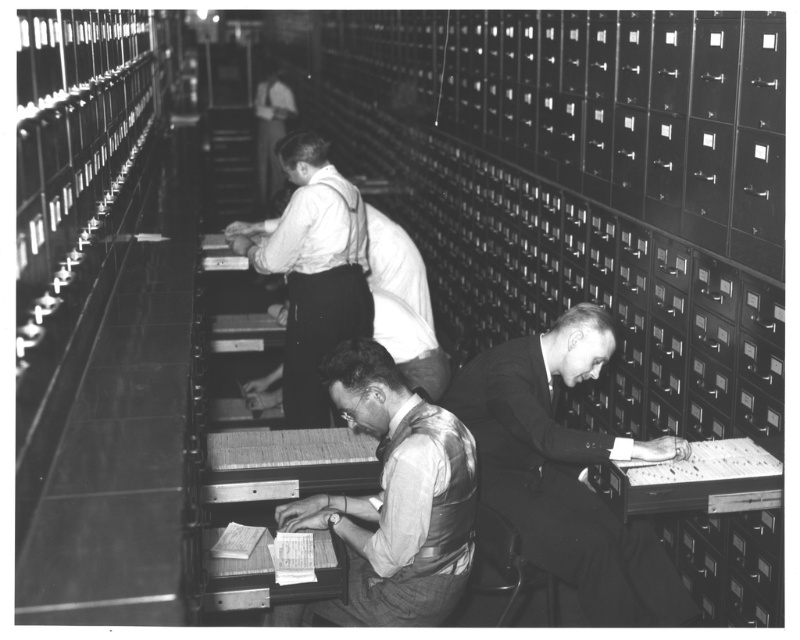
You are an observer in the library scene. You notice two items of clothing at the center of the image. Which one is closer to you, the light gray fabric vest at center or the light gray shirt at center?

The light gray fabric vest at center is closer to you because it is in front of the light gray shirt at center.

You are a tailor observing the two men in the image. You need to determine which garment requires more fabric to make between the smooth black suit at center and the light gray shirt at center. Based on their widths, which one would need more fabric?

The light gray shirt at center is wider than the smooth black suit at center, so it would require more fabric to make.

You are an observer standing in front of the scene. You see the smooth black suit at center and the light gray fabric vest at center. Which one is closer to you?

The smooth black suit at center is closer to you because it is further to the viewer than the light gray fabric vest at center.